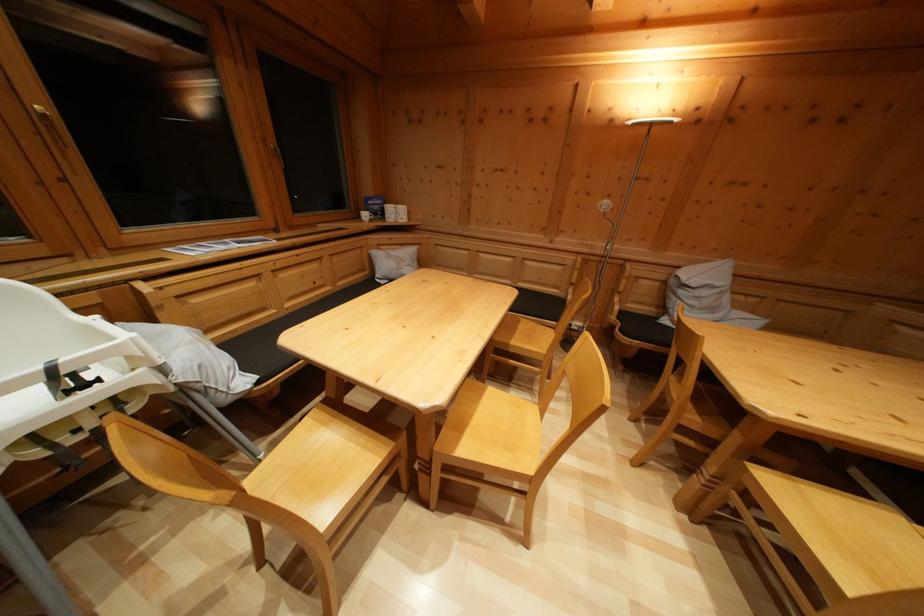
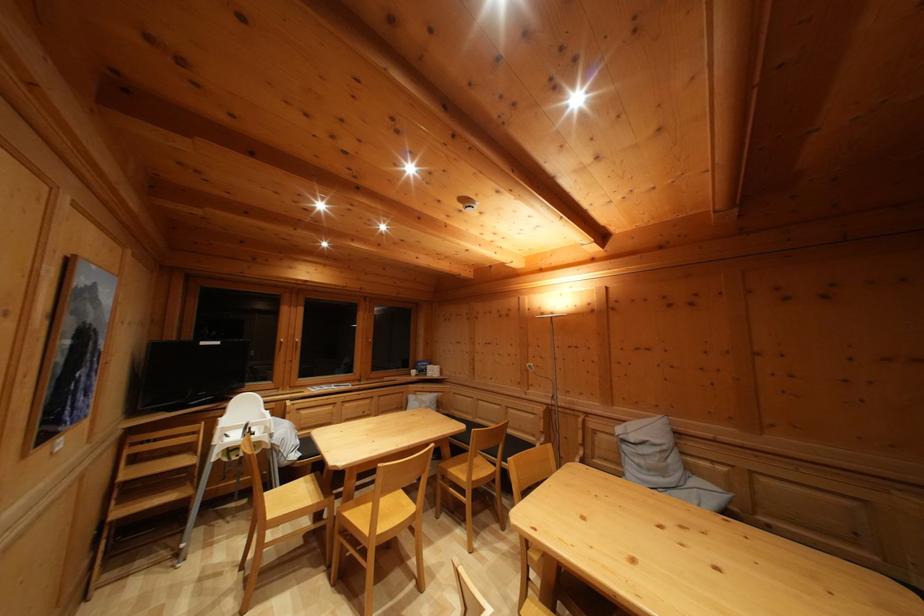
Where in the second image is the point corresponding to (398,451) from the first image?

(329, 506)